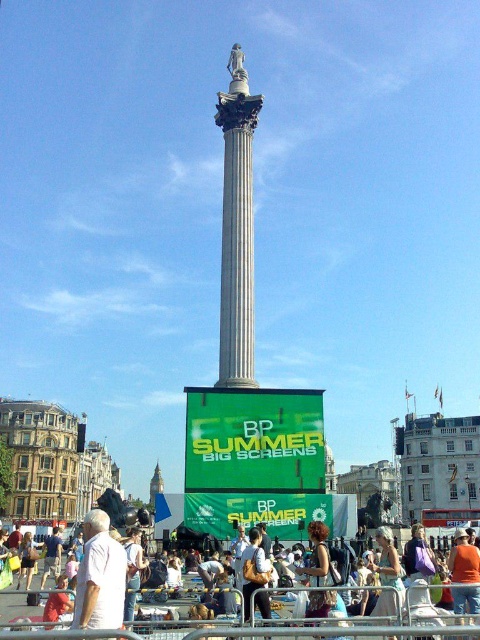
Question: Does white cotton shirt at lower center have a smaller size compared to light brown leather jacket at center?

Choices:
 (A) yes
 (B) no

Answer: (B)

Question: Which is nearer to the light brown leather jacket at center?

Choices:
 (A) white marble column at center
 (B) white cotton shirt at lower left
 (C) orange fabric shirt at center
 (D) white cotton shirt at lower center

Answer: (D)

Question: Among these objects, which one is nearest to the camera?

Choices:
 (A) white cotton shirt at lower center
 (B) white cotton shirt at lower left
 (C) white marble column at center

Answer: (A)

Question: Does white cotton shirt at lower center appear on the left side of white cotton shirt at lower left?

Choices:
 (A) no
 (B) yes

Answer: (A)

Question: Is white cotton shirt at lower center bigger than white cotton shirt at lower left?

Choices:
 (A) yes
 (B) no

Answer: (A)

Question: Which point is closer to the camera?

Choices:
 (A) (466, 580)
 (B) (220, 317)
 (C) (242, 554)

Answer: (A)